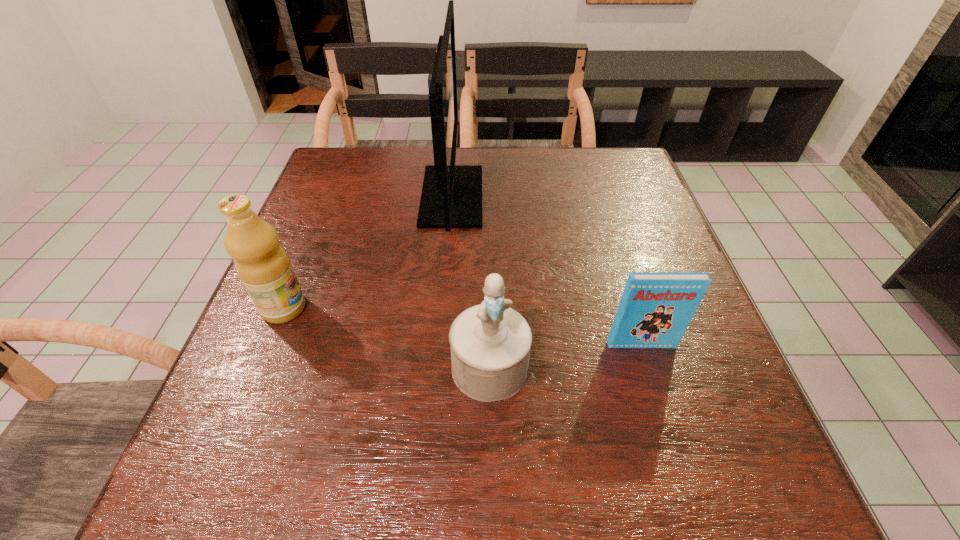
Where is `monitor`? The width and height of the screenshot is (960, 540). monitor is located at coordinates (451, 197).

Where is `the tallest object`? Image resolution: width=960 pixels, height=540 pixels. the tallest object is located at coordinates (451, 197).

Where is `olive oil`? Image resolution: width=960 pixels, height=540 pixels. olive oil is located at coordinates pos(262,264).

You are a GUI agent. You are given a task and a screenshot of the screen. Output one action in this format:
    pyautogui.click(x=<x>, y=<y>)
    Task: Click on the leftmost object
    The image size is (960, 540).
    Given the screenshot: What is the action you would take?
    pyautogui.click(x=262, y=264)

Locate an element on the screen. figurine is located at coordinates pyautogui.click(x=490, y=343).

Where is `book`? The height and width of the screenshot is (540, 960). book is located at coordinates 655,309.

The height and width of the screenshot is (540, 960). I want to click on the rightmost object, so click(655, 309).

The height and width of the screenshot is (540, 960). What are the coordinates of `blank space located 0.300m on the screen side of the monitor` in the screenshot? It's located at 595,196.

Identify the location of free spot located on the label of the leftmost object. The height and width of the screenshot is (540, 960). (360, 308).

Where is `free space located 0.090m at the beak of the figurine`? free space located 0.090m at the beak of the figurine is located at coordinates (491, 455).